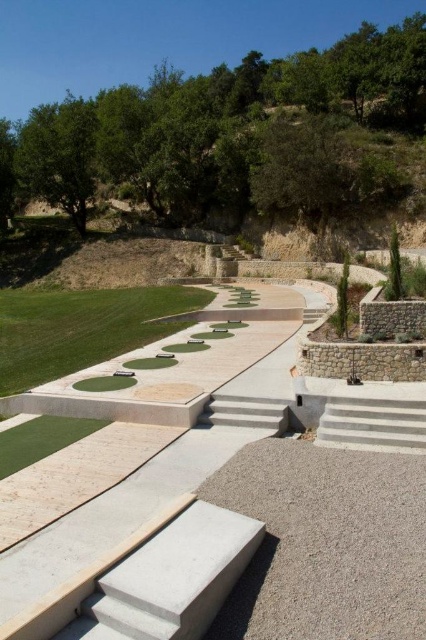
Between gray concrete at center and concrete stairs at center, which one appears on the left side from the viewer's perspective?

concrete stairs at center is more to the left.

The width and height of the screenshot is (426, 640). What do you see at coordinates (325, 544) in the screenshot? I see `gray concrete at center` at bounding box center [325, 544].

Describe the element at coordinates (325, 544) in the screenshot. I see `gray concrete at center` at that location.

Image resolution: width=426 pixels, height=640 pixels. I want to click on gray concrete at center, so click(x=325, y=544).

Can you confirm if gray concrete at center is positioned below green artificial turf at lower left?

Yes, gray concrete at center is below green artificial turf at lower left.

Find the location of `gray concrete at center`. gray concrete at center is located at coordinates (325, 544).

Does white concrete stairs at lower right have a smaller size compared to green artificial turf at lower left?

Yes.

Between point (374, 440) and point (37, 456), which one is positioned behind?

The point (374, 440) is more distant.

This screenshot has height=640, width=426. Find the location of `white concrete stairs at lower right`. white concrete stairs at lower right is located at coordinates (374, 424).